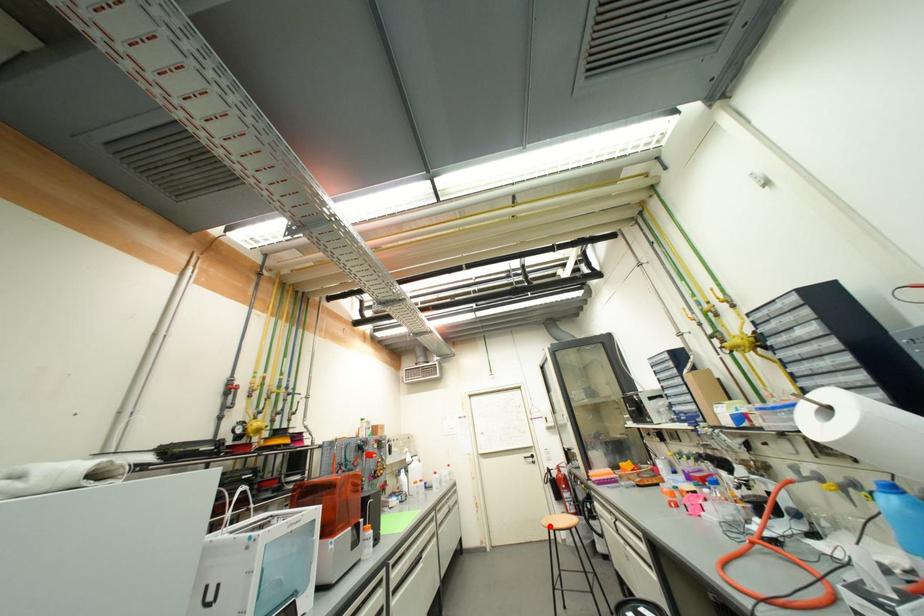
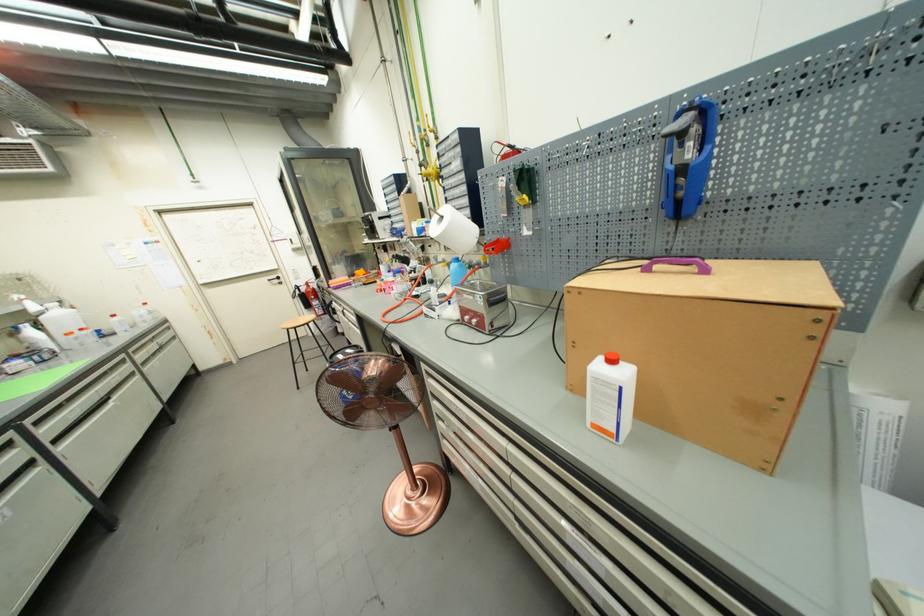
The point at the highlighted location is marked in the first image. Where is the corresponding point in the second image?

(288, 329)